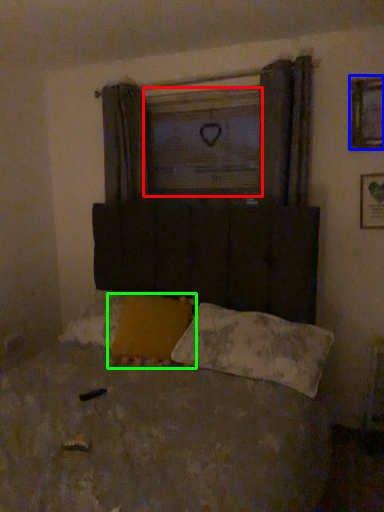
Question: Which object is the farthest from window screen (highlighted by a red box)? Choose among these: picture frame (highlighted by a blue box) or pillow (highlighted by a green box).

Choices:
 (A) picture frame
 (B) pillow

Answer: (B)